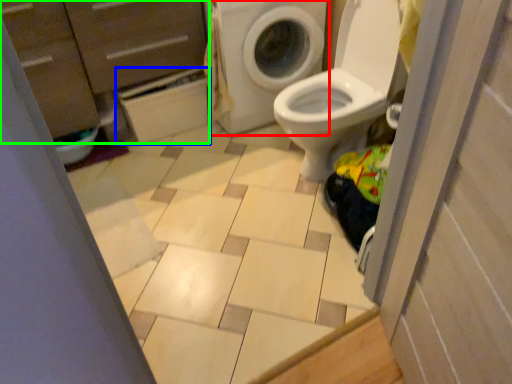
Question: Based on their relative distances, which object is farther from washing machine (highlighted by a red box)? Choose from cabinetry (highlighted by a blue box) and dresser (highlighted by a green box).

Choices:
 (A) cabinetry
 (B) dresser

Answer: (B)